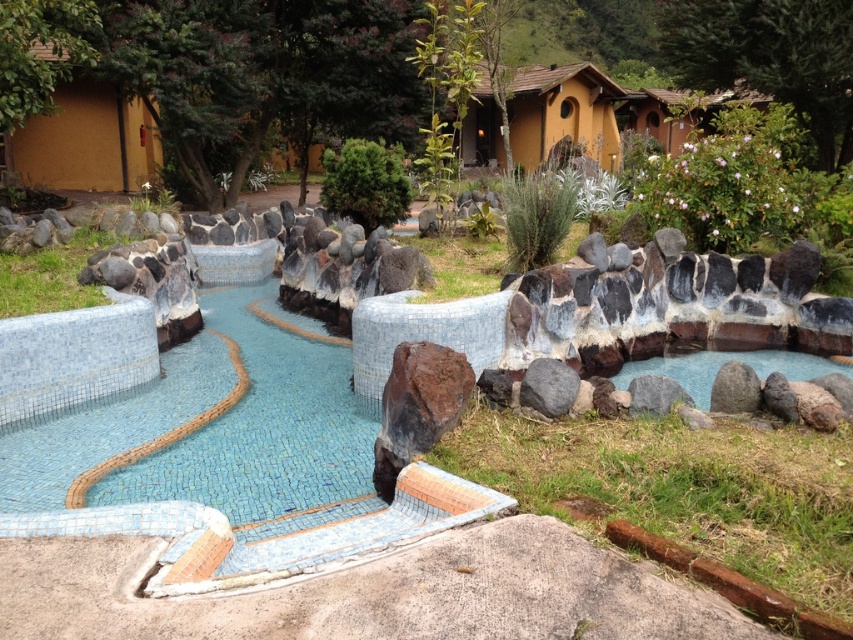
Question: Can you confirm if blue mosaic pool at center is smaller than smooth stone pond at right?

Choices:
 (A) no
 (B) yes

Answer: (A)

Question: Which point is farther to the camera?

Choices:
 (A) brown rough rock at center
 (B) dark gray rock at center

Answer: (B)

Question: Among these points, which one is farthest from the camera?

Choices:
 (A) (712, 406)
 (B) (534, 403)
 (C) (402, 380)

Answer: (A)

Question: Based on their relative distances, which object is nearer to the dark gray rock at center?

Choices:
 (A) smooth stone pond at right
 (B) blue mosaic pool at center
 (C) gray rough rock at lower right
 (D) gray rock at center

Answer: (D)

Question: Can you confirm if smooth stone pond at right is wider than dark gray rock at center?

Choices:
 (A) yes
 (B) no

Answer: (A)

Question: Is blue mosaic pool at center below dark gray rock at center?

Choices:
 (A) yes
 (B) no

Answer: (A)